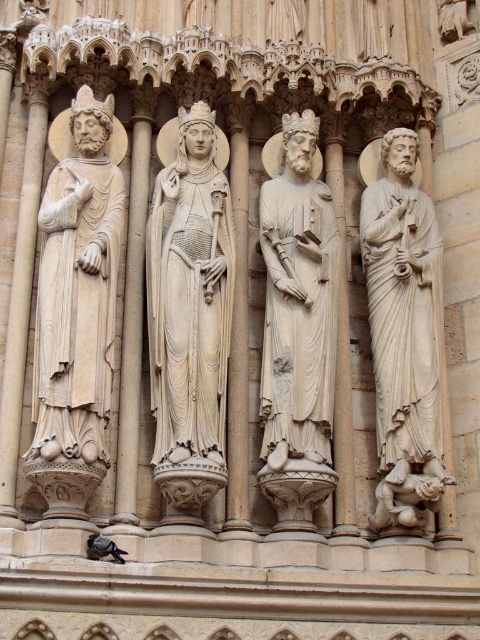
Does beige stone statue at left have a greater height compared to white marble statue at right?

Incorrect, beige stone statue at left's height is not larger of white marble statue at right's.

Between beige stone statue at left and white marble statue at right, which one is positioned lower?

Positioned lower is white marble statue at right.

The height and width of the screenshot is (640, 480). What do you see at coordinates (78, 289) in the screenshot?
I see `beige stone statue at left` at bounding box center [78, 289].

At what (x,y) coordinates should I click in order to perform the action: click on beige stone statue at left. Please return your answer as a coordinate pair (x, y). This screenshot has width=480, height=640. Looking at the image, I should click on (78, 289).

Based on the photo, between white marble statue at center and white marble statue at right, which one has more height?

white marble statue at right

Which is below, white marble statue at center or white marble statue at right?

white marble statue at right

Who is more forward, (189, 470) or (403, 480)?

Positioned in front is point (189, 470).

Where is `white marble statue at center`? This screenshot has width=480, height=640. white marble statue at center is located at coordinates (190, 308).

Which is in front, point (188, 224) or point (267, 220)?

Point (188, 224) is more forward.

Which is below, white marble statue at center or white stone statue at center?

white stone statue at center

Which is behind, point (211, 388) or point (297, 227)?

The point (297, 227) is behind.

I want to click on white marble statue at center, so click(190, 308).